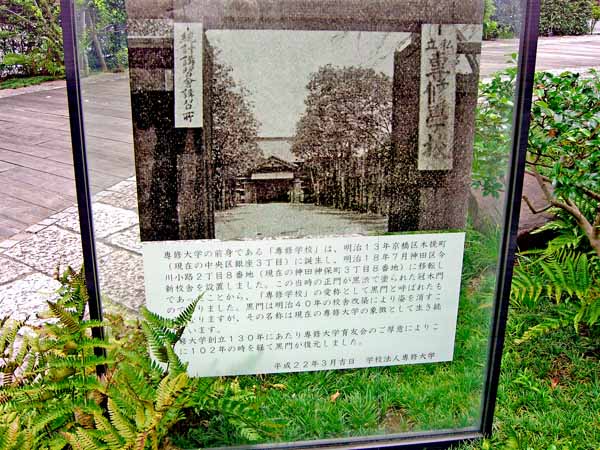
The image size is (600, 450). Find the location of `cement tile`. cement tile is located at coordinates (53, 252).